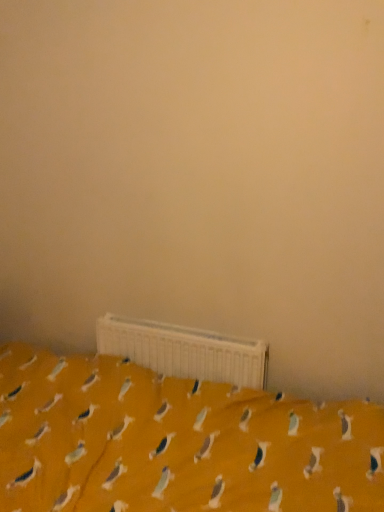
What do you see at coordinates (184, 351) in the screenshot? This screenshot has height=512, width=384. I see `white plastic radiator at center` at bounding box center [184, 351].

The height and width of the screenshot is (512, 384). What are the coordinates of `white plastic radiator at center` in the screenshot? It's located at (184, 351).

The width and height of the screenshot is (384, 512). Identify the location of white plastic radiator at center. [x=184, y=351].